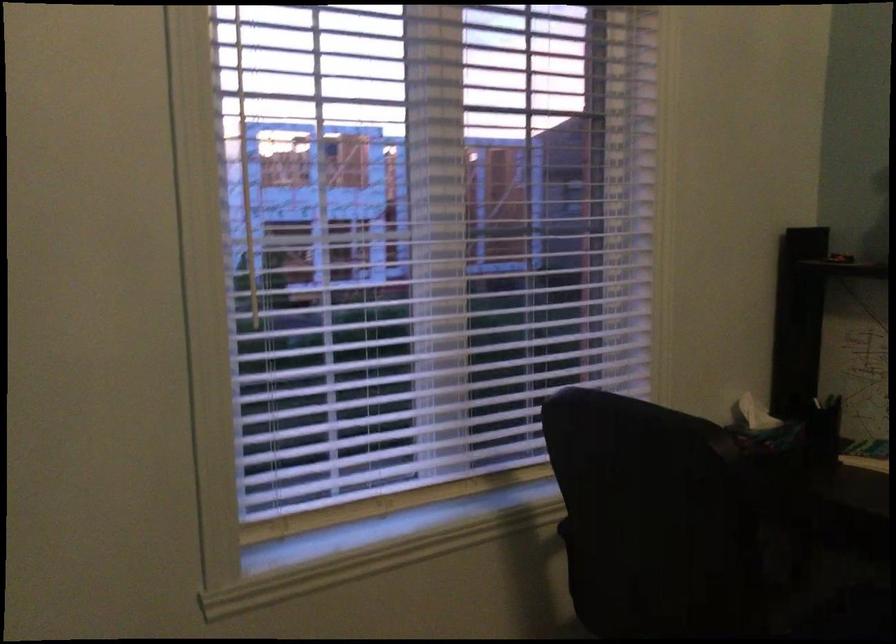
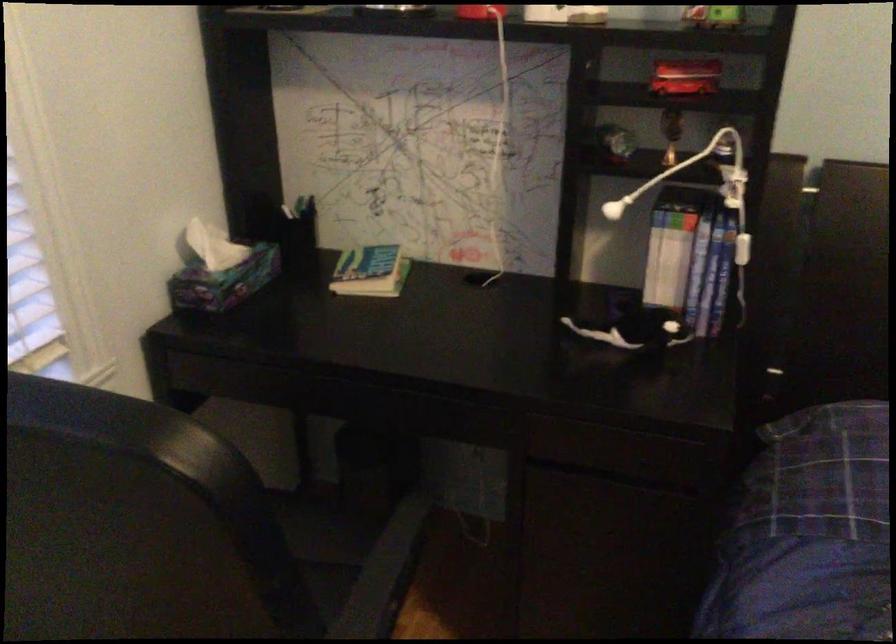
Locate, in the second image, the point that corresponds to point (757, 409) in the first image.

(213, 245)